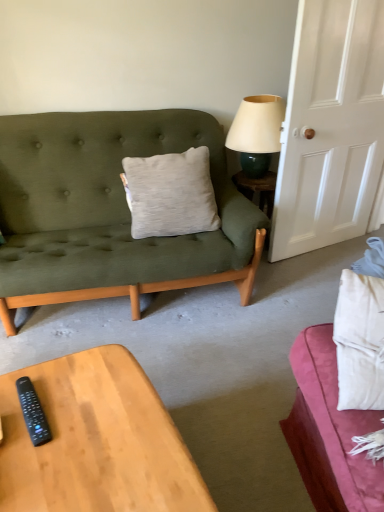
Find the location of a particular element. free space to the back side of black plastic remote at lower left is located at coordinates [65, 372].